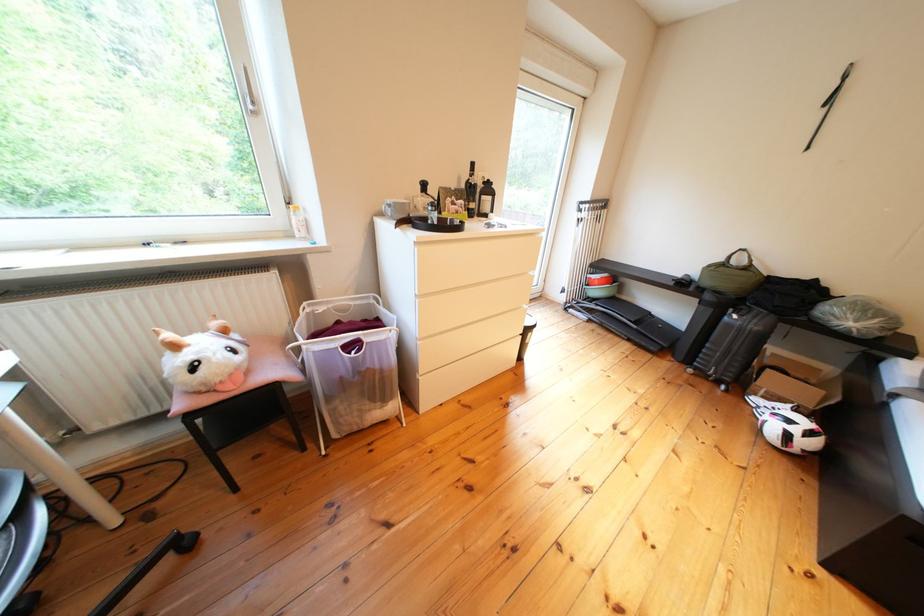
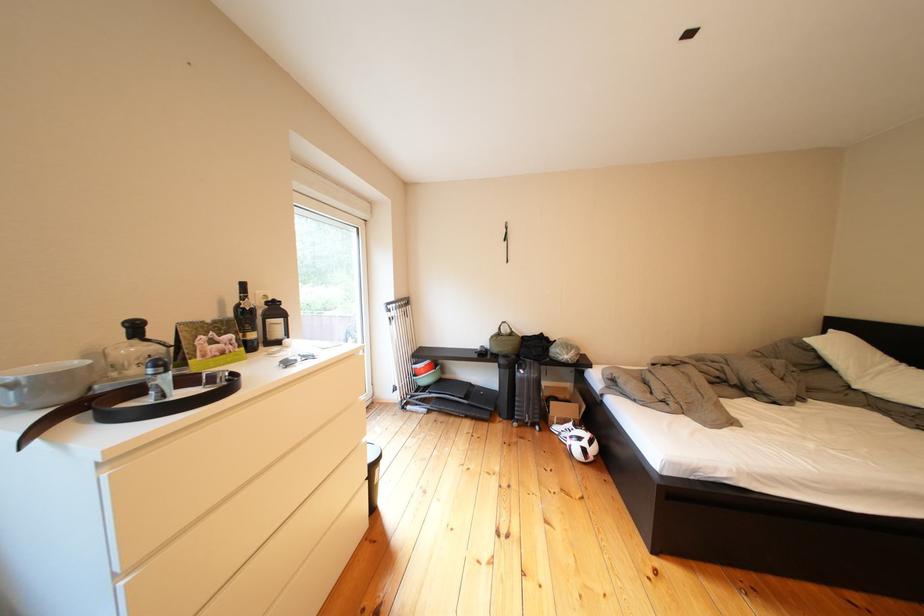
Where in the second image is the point corresponding to (541,312) from the first image?

(378, 445)